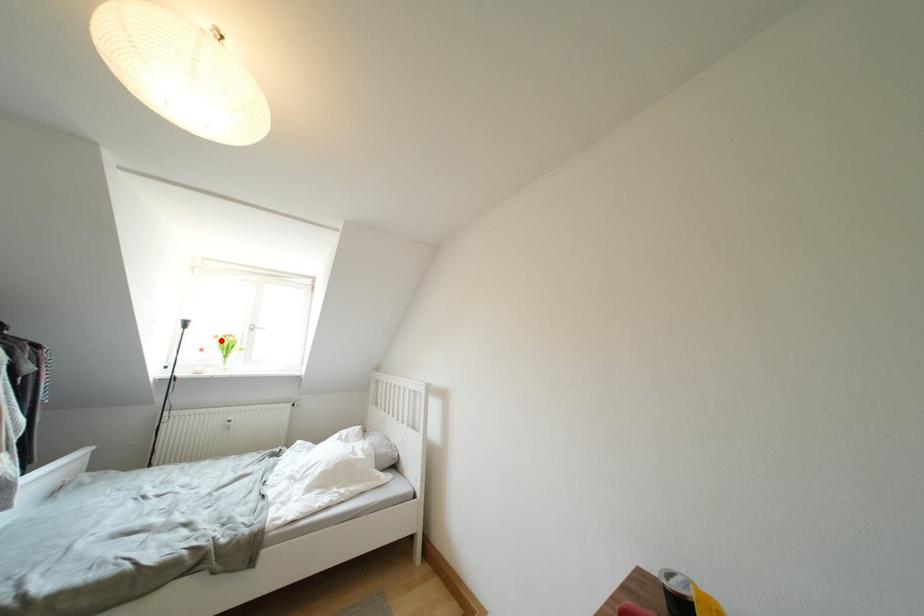
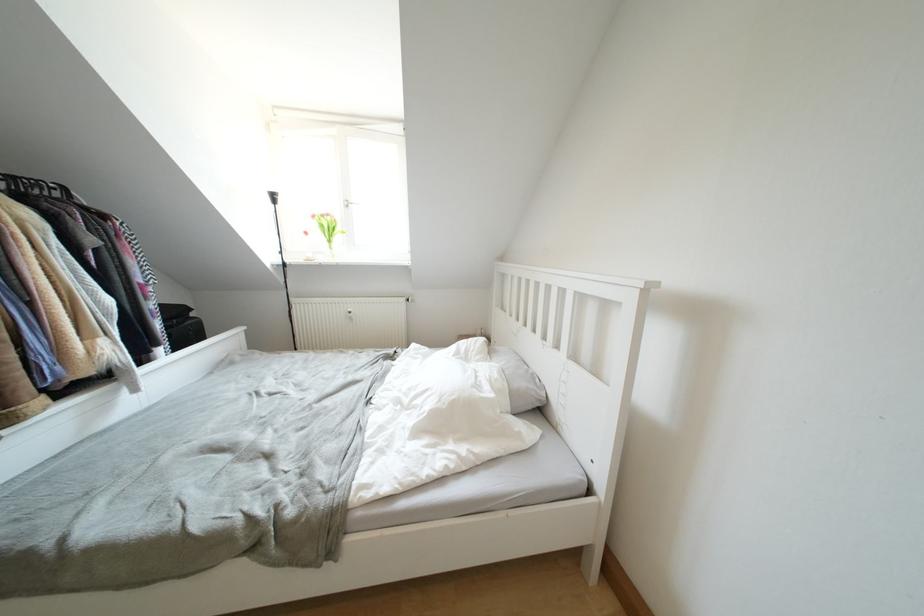
Question: I am providing you with two images of the same scene from different viewpoints. In image1, a red point is highlighted. Considering the same 3D point in image2, which of the following is correct?

Choices:
 (A) It is closer
 (B) It is farther

Answer: (A)